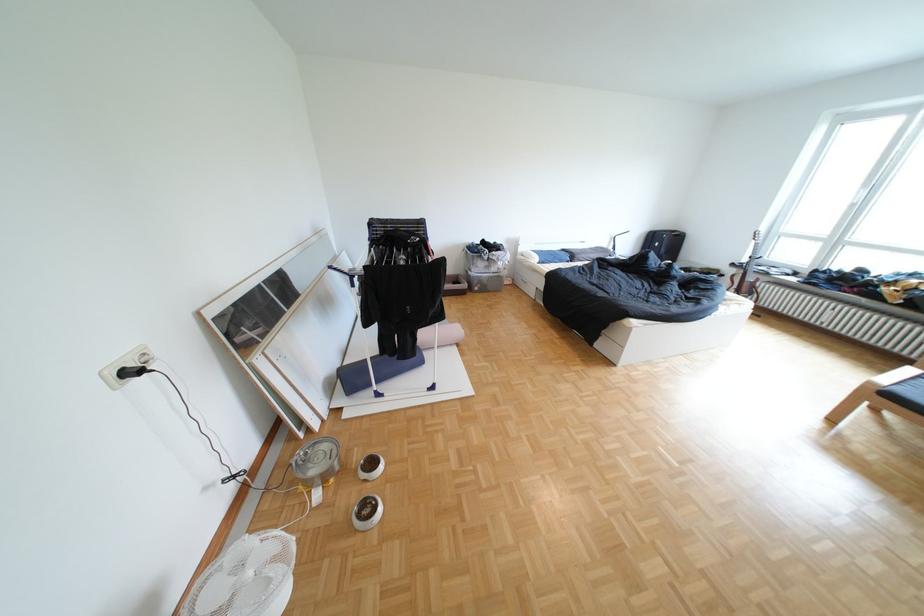
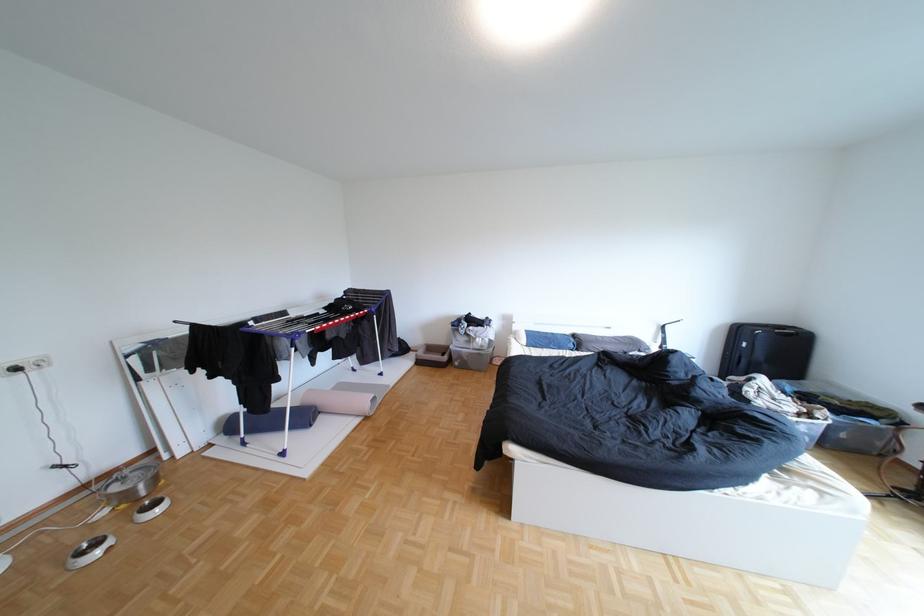
The point at (578, 251) is marked in the first image. Where is the corresponding point in the second image?

(590, 336)